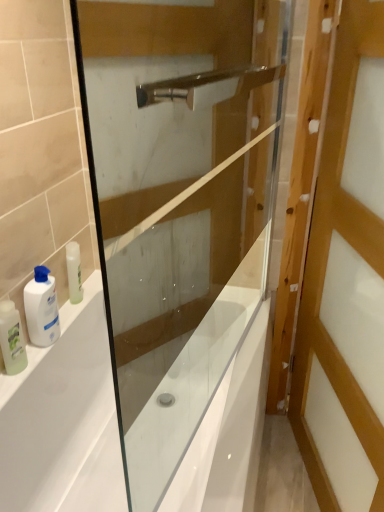
Question: Would you say transparent glass screen door at center is part of wooden door at right's contents?

Choices:
 (A) yes
 (B) no

Answer: (B)

Question: Is wooden door at right in contact with transparent glass screen door at center?

Choices:
 (A) yes
 (B) no

Answer: (B)

Question: Is wooden door at right further to camera compared to transparent glass screen door at center?

Choices:
 (A) no
 (B) yes

Answer: (B)

Question: Is wooden door at right positioned far away from transparent glass screen door at center?

Choices:
 (A) yes
 (B) no

Answer: (B)

Question: From a real-world perspective, is wooden door at right on transparent glass screen door at center?

Choices:
 (A) yes
 (B) no

Answer: (B)

Question: Considering the relative sizes of wooden door at right and transparent glass screen door at center in the image provided, is wooden door at right smaller than transparent glass screen door at center?

Choices:
 (A) no
 (B) yes

Answer: (A)

Question: From a real-world perspective, is wooden door at right located beneath translucent plastic bottle at left, which appears as the first toiletry when viewed from the left?

Choices:
 (A) yes
 (B) no

Answer: (B)

Question: Is wooden door at right further to camera compared to translucent plastic bottle at left, arranged as the second toiletry when viewed from the right?

Choices:
 (A) yes
 (B) no

Answer: (B)

Question: Could you tell me if wooden door at right is turned towards translucent plastic bottle at left, which appears as the first toiletry when viewed from the left?

Choices:
 (A) no
 (B) yes

Answer: (B)

Question: From a real-world perspective, is wooden door at right positioned over translucent plastic bottle at left, which appears as the first toiletry when viewed from the left, based on gravity?

Choices:
 (A) yes
 (B) no

Answer: (A)

Question: Is wooden door at right to the right of translucent plastic bottle at left, which appears as the first toiletry when viewed from the left, from the viewer's perspective?

Choices:
 (A) yes
 (B) no

Answer: (A)

Question: Does wooden door at right have a greater height compared to translucent plastic bottle at left, which appears as the first toiletry when viewed from the left?

Choices:
 (A) no
 (B) yes

Answer: (B)

Question: Considering the relative sizes of white glossy bathtub at lower left and wooden door at right in the image provided, is white glossy bathtub at lower left smaller than wooden door at right?

Choices:
 (A) no
 (B) yes

Answer: (A)